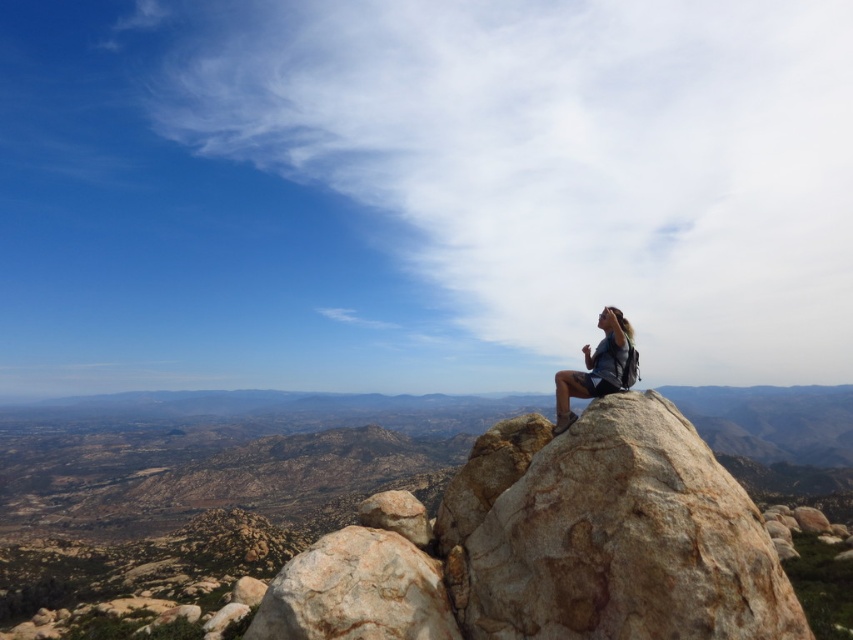
Question: Which of the following is the farthest from the observer?

Choices:
 (A) (341, 637)
 (B) (347, 518)
 (C) (601, 381)
 (D) (576, 506)

Answer: (B)

Question: Which of the following is the closest to the observer?

Choices:
 (A) brown rough rock at center
 (B) dark gray backpack at center

Answer: (A)

Question: Is brown rough rock at upper center behind dark gray backpack at center?

Choices:
 (A) yes
 (B) no

Answer: (A)

Question: Which object appears closest to the camera in this image?

Choices:
 (A) dark gray backpack at center
 (B) brown rough rock at upper center
 (C) brown rough rock at center

Answer: (C)

Question: Is brown rough rock at upper center in front of dark gray backpack at center?

Choices:
 (A) no
 (B) yes

Answer: (A)

Question: Is brown rough rock at center wider than rough textured rock at center?

Choices:
 (A) yes
 (B) no

Answer: (A)